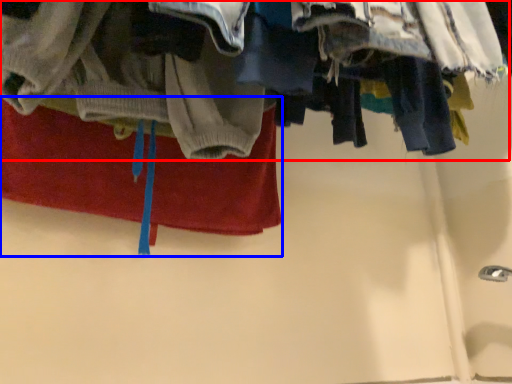
Question: Which object appears closest to the camera in this image, closet (highlighted by a red box) or towel (highlighted by a blue box)?

Choices:
 (A) closet
 (B) towel

Answer: (A)